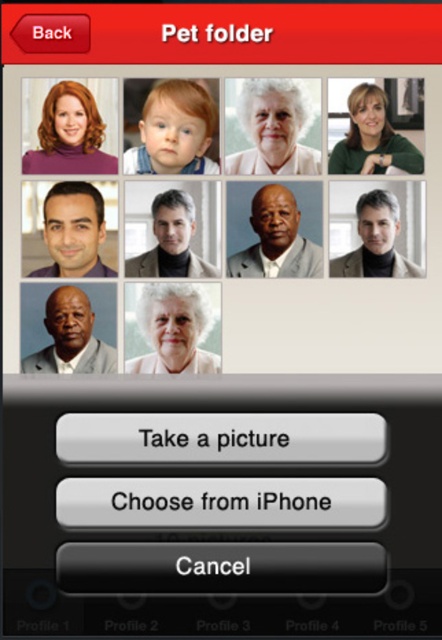
You are a user of the app and want to locate the gray suit jacket at center. According to the app interface, where exactly is it positioned?

The gray suit jacket at center is positioned at point (71, 337).

You are trying to decide which clothing item to wear for a casual day out. You see the matte purple turtleneck at upper left and the matte black jacket at center in your closet. Based on their sizes, which one might be more suitable for layering under a coat?

The matte purple turtleneck at upper left has a greater height compared to the matte black jacket at center, so it might be more suitable for layering under a coat since it covers more of the body.